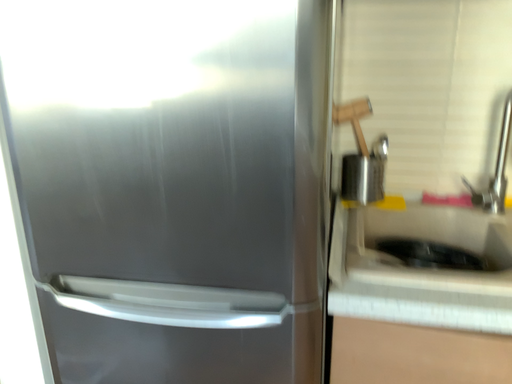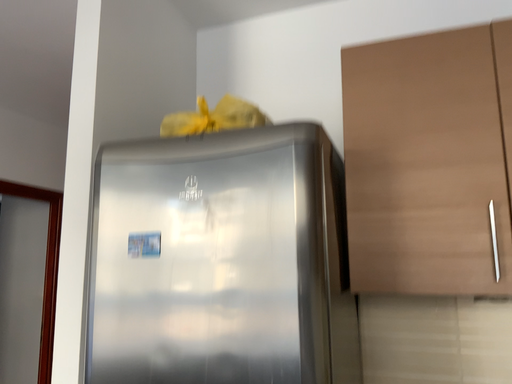
Question: Which way did the camera rotate in the video?

Choices:
 (A) rotated downward
 (B) rotated upward

Answer: (B)